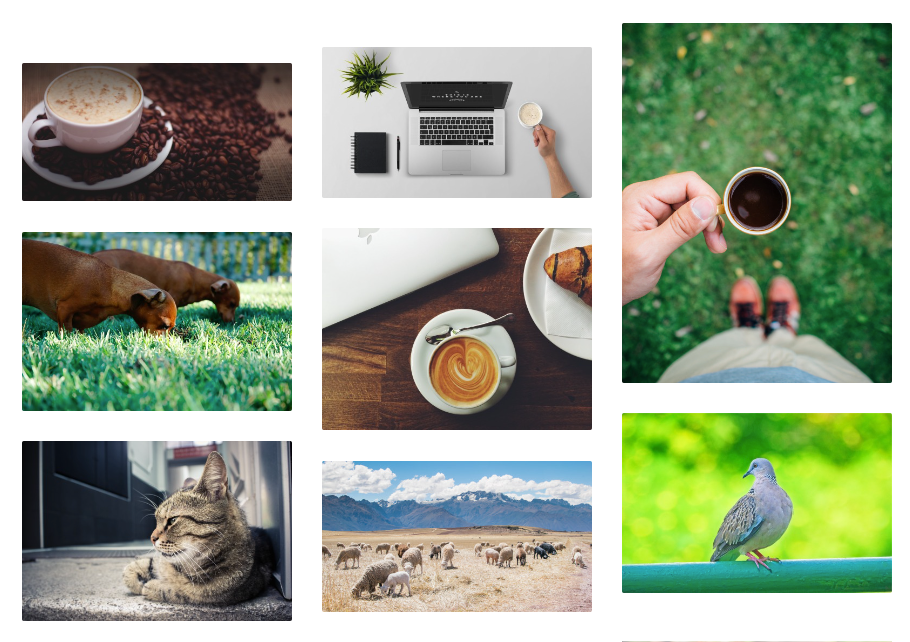
The image size is (910, 642). I want to click on computer, so click(492, 164).